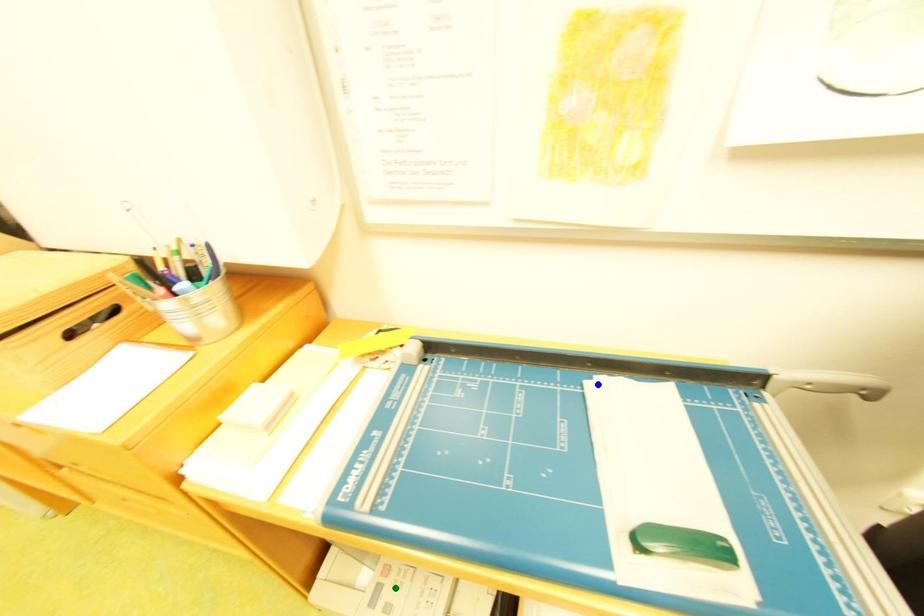
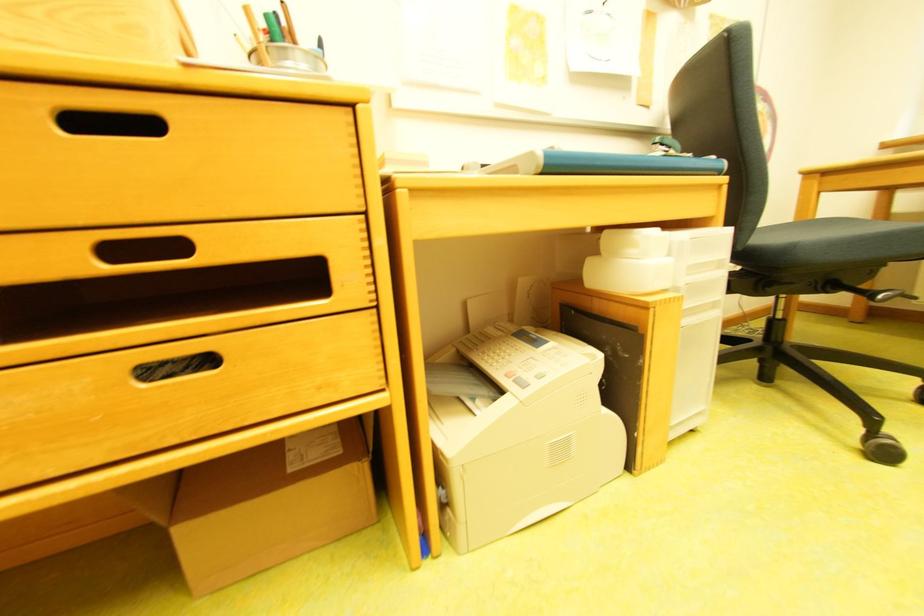
I am providing you with two images of the same scene from different viewpoints. Three points are marked in image1. Which point corresponds to a part or object that is occluded in image2?In image1, three points are marked. Which of them correspond to a part or object that is occluded in image2?Among the three points shown in image1, which one corresponds to a part or object that is no longer visible due to occlusion in image2?

blue point cannot be seen in image2.